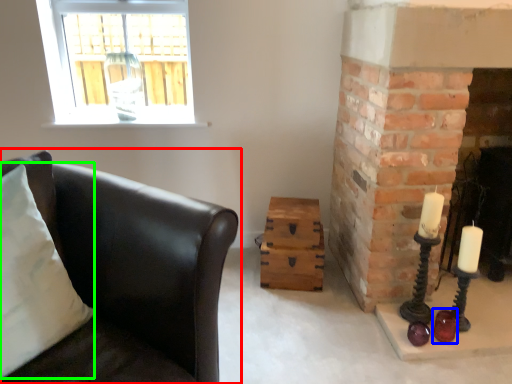
Question: Considering the real-world distances, which object is closest to studio couch (highlighted by a red box)? candle holder (highlighted by a blue box) or pillow (highlighted by a green box).

Choices:
 (A) candle holder
 (B) pillow

Answer: (B)